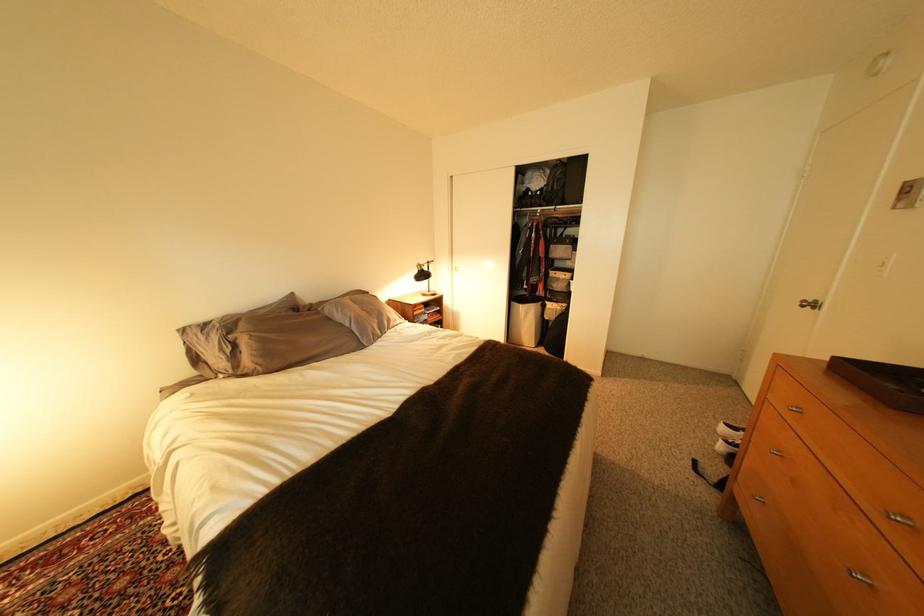
This screenshot has width=924, height=616. In order to click on black desk lamp in this screenshot , I will do `click(423, 277)`.